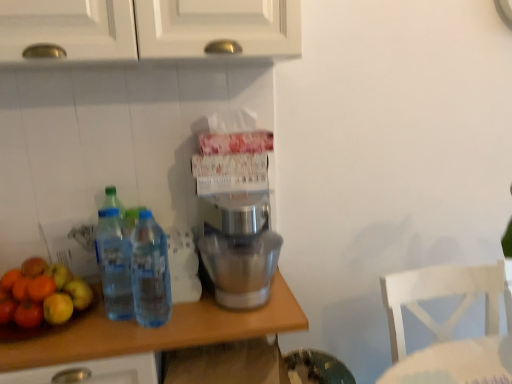
Question: Do you think shiny green apple at left is within white wooden chair at lower right, or outside of it?

Choices:
 (A) inside
 (B) outside

Answer: (B)

Question: Is shiny green apple at left wider or thinner than white wooden chair at lower right?

Choices:
 (A) wide
 (B) thin

Answer: (B)

Question: Estimate the real-world distances between objects in this image. Which object is closer to the transparent plastic bottles at left, the second bottle viewed from the right?

Choices:
 (A) shiny green apple at left
 (B) white wooden chair at lower right
 (C) satin silver mixer at center
 (D) clear wood countertop at center
 (E) clear plastic bottles at center, the first bottle in the right-to-left sequence

Answer: (E)

Question: Which object is the farthest from the clear wood countertop at center?

Choices:
 (A) white wooden chair at lower right
 (B) shiny green apple at left
 (C) clear plastic bottles at center, arranged as the 2th bottle when viewed from the left
 (D) satin silver mixer at center
 (E) transparent plastic bottles at left, the first bottle viewed from the left

Answer: (A)